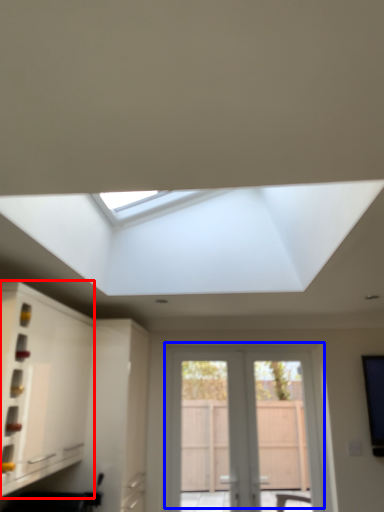
Question: Which object appears farthest to the camera in this image, cabinetry (highlighted by a red box) or door (highlighted by a blue box)?

Choices:
 (A) cabinetry
 (B) door

Answer: (B)